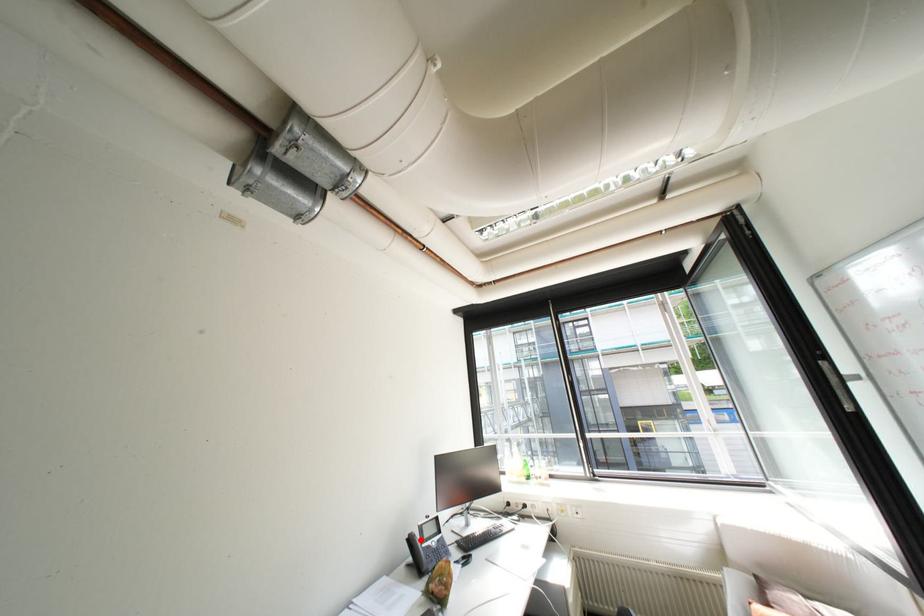
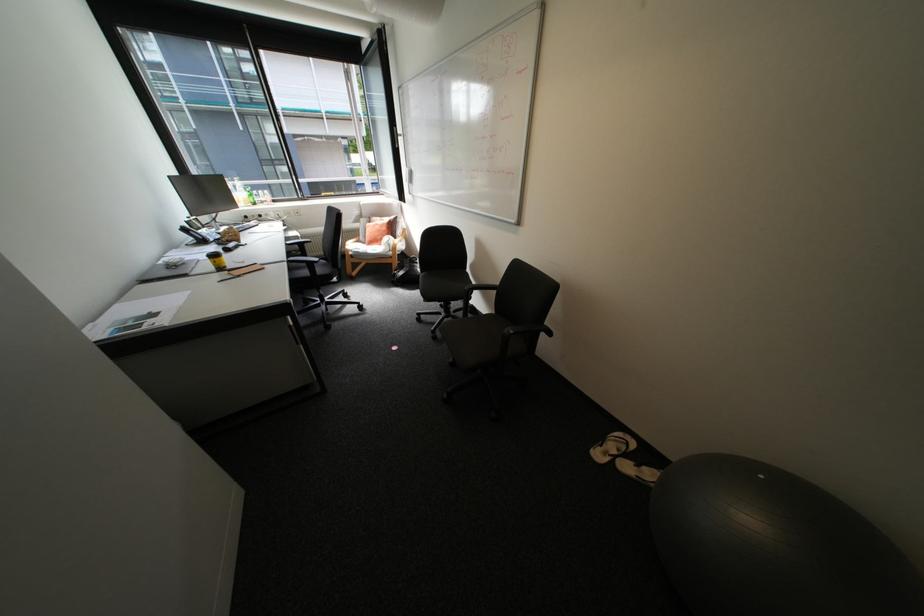
Question: A red point is marked in image1. In image2, is the corresponding 3D point closer to the camera or farther? Reply with the corresponding letter.

Choices:
 (A) The corresponding 3D point is closer.
 (B) The corresponding 3D point is farther.

Answer: (A)